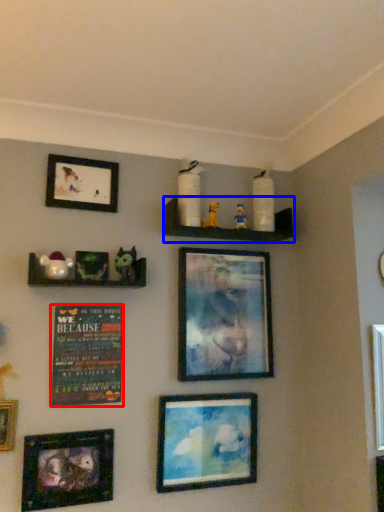
Question: Which object appears closest to the camera in this image, plaque (highlighted by a red box) or shelf (highlighted by a blue box)?

Choices:
 (A) plaque
 (B) shelf

Answer: (A)